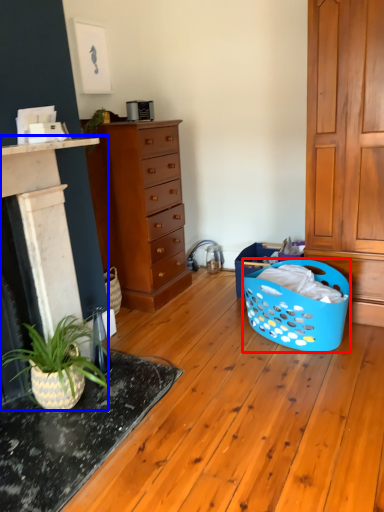
Question: Which object is further to the camera taking this photo, basket (highlighted by a red box) or fireplace (highlighted by a blue box)?

Choices:
 (A) basket
 (B) fireplace

Answer: (A)